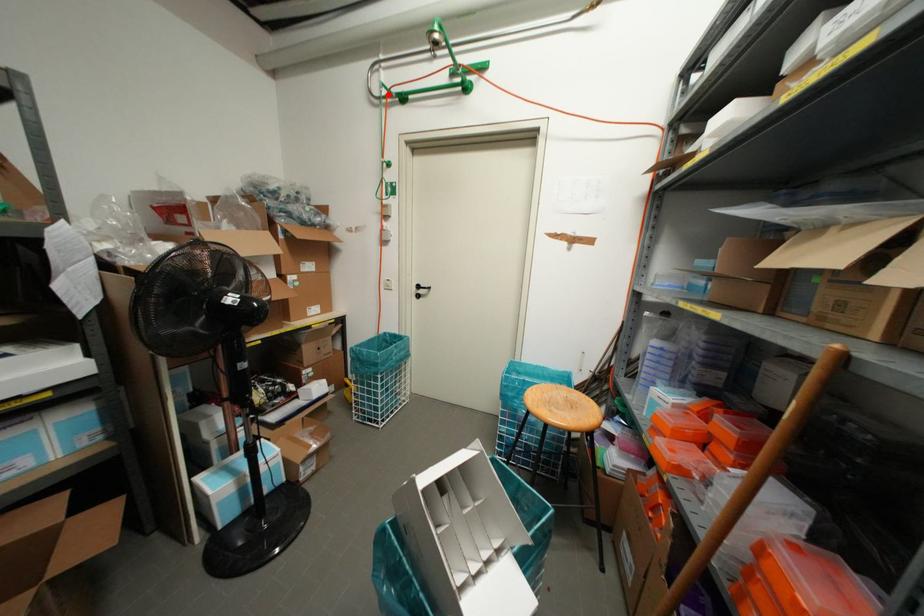
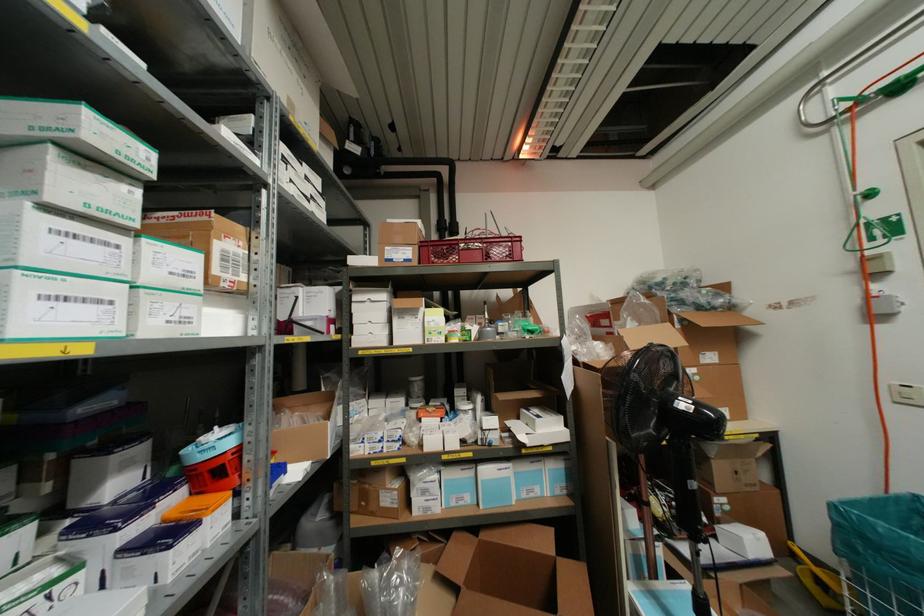
In the second image, find the point that corresponds to the highlighted location in the first image.

(859, 100)